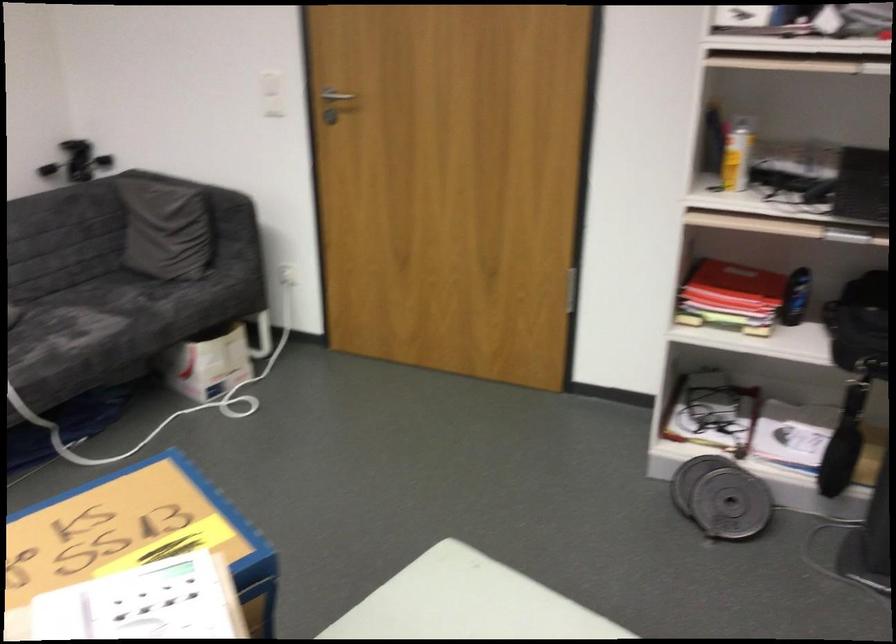
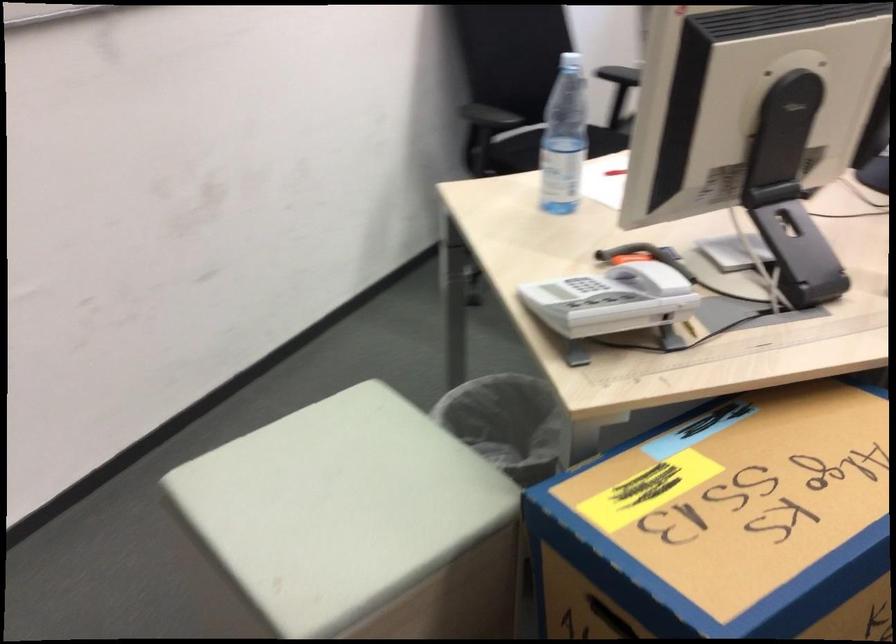
Locate, in the second image, the point that corresponds to point 242,567 in the first image.

(600, 617)